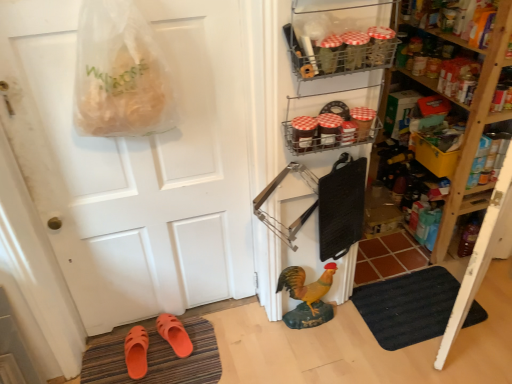
This screenshot has height=384, width=512. In order to click on free space to the right of orange rubber slippers at lower left, which is the second footwear from left to right in this screenshot , I will do `click(203, 344)`.